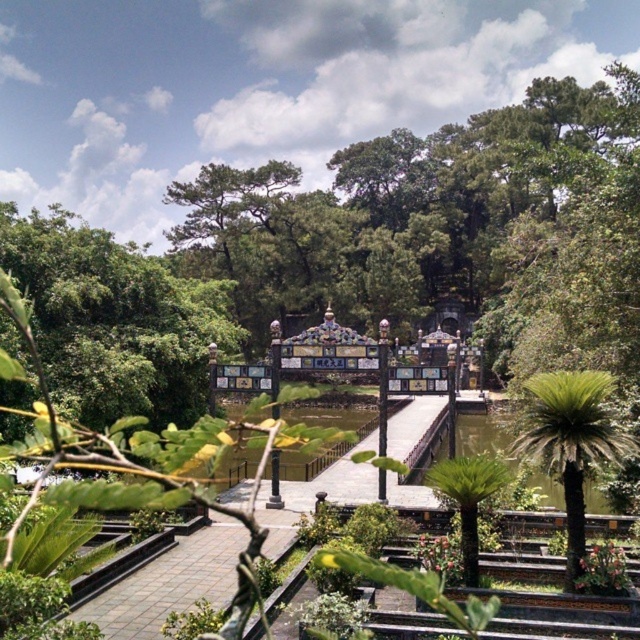
Question: Is green leafy tree at center above green leafy palm at right?

Choices:
 (A) no
 (B) yes

Answer: (B)

Question: Does green leafy palm at right lie behind green leafy palm trees at center?

Choices:
 (A) no
 (B) yes

Answer: (A)

Question: Which point is closer to the camera taking this photo?

Choices:
 (A) (488, 429)
 (B) (58, 307)

Answer: (B)

Question: Which point is farther to the camera?

Choices:
 (A) green leafy palm at right
 (B) green leafy palm trees at center
 (C) green leafy tree at center

Answer: (C)

Question: Which point appears farthest from the camera in this image?

Choices:
 (A) (16, 244)
 (B) (497, 429)
 (C) (600, 449)

Answer: (B)

Question: Is green leafy tree at center thinner than green leafy palm trees at center?

Choices:
 (A) no
 (B) yes

Answer: (A)